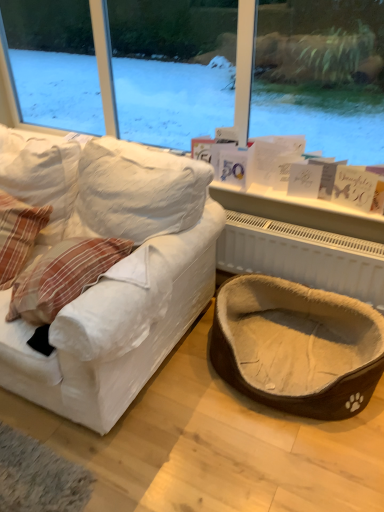
Question: Is white textured radiator at lower right smaller than plaid fabric pillow at left?

Choices:
 (A) no
 (B) yes

Answer: (B)

Question: Is white textured radiator at lower right looking in the opposite direction of plaid fabric pillow at left?

Choices:
 (A) yes
 (B) no

Answer: (B)

Question: Is white textured radiator at lower right not within plaid fabric pillow at left?

Choices:
 (A) no
 (B) yes

Answer: (B)

Question: Considering the relative positions of white textured radiator at lower right and plaid fabric pillow at left in the image provided, is white textured radiator at lower right to the left of plaid fabric pillow at left from the viewer's perspective?

Choices:
 (A) no
 (B) yes

Answer: (A)

Question: Is white textured radiator at lower right bigger than plaid fabric pillow at left?

Choices:
 (A) no
 (B) yes

Answer: (A)

Question: Can you confirm if white textured radiator at lower right is positioned to the right of plaid fabric pillow at left?

Choices:
 (A) no
 (B) yes

Answer: (B)

Question: Can you confirm if plaid fabric pillow at left is smaller than white textured radiator at lower right?

Choices:
 (A) no
 (B) yes

Answer: (A)

Question: Is plaid fabric pillow at left at the right side of white textured radiator at lower right?

Choices:
 (A) no
 (B) yes

Answer: (A)

Question: Would you say plaid fabric pillow at left contains white textured radiator at lower right?

Choices:
 (A) no
 (B) yes

Answer: (A)

Question: Is plaid fabric pillow at left looking in the opposite direction of white textured radiator at lower right?

Choices:
 (A) yes
 (B) no

Answer: (B)

Question: From a real-world perspective, does plaid fabric pillow at left stand above white textured radiator at lower right?

Choices:
 (A) yes
 (B) no

Answer: (A)

Question: Does plaid fabric pillow at left have a lesser width compared to white textured radiator at lower right?

Choices:
 (A) no
 (B) yes

Answer: (A)

Question: Can you confirm if brown fuzzy pet bed at lower right is wider than white fabric couch at left?

Choices:
 (A) yes
 (B) no

Answer: (B)